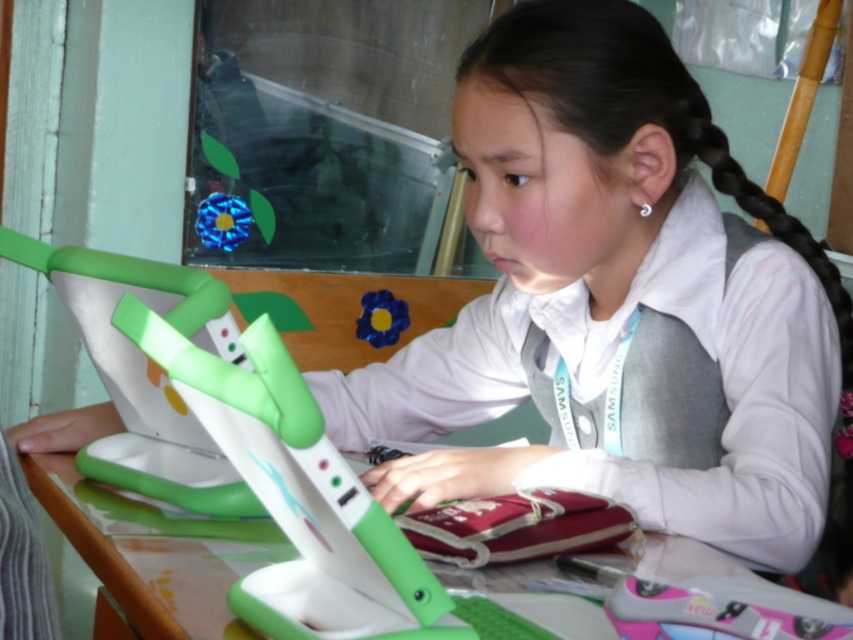
Is point (206, 573) less distant than point (726, 140)?

Yes, it is.

Is point (49, 513) farther from viewer compared to point (805, 241)?

No, (49, 513) is closer to viewer.

What do you see at coordinates (100, 548) in the screenshot? I see `wooden table at lower center` at bounding box center [100, 548].

Locate an element on the screen. The height and width of the screenshot is (640, 853). wooden table at lower center is located at coordinates (100, 548).